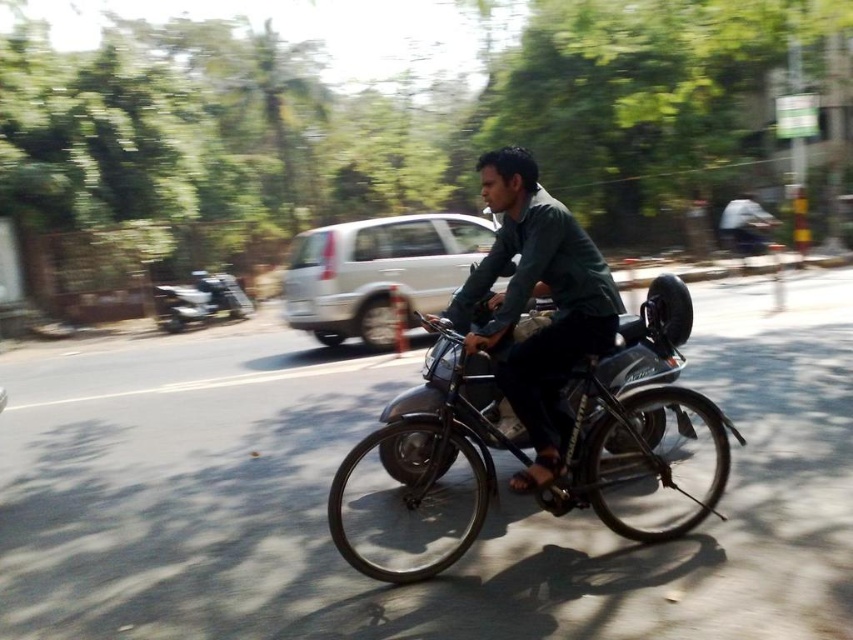
Between metallic silver motorcycle at center and green matte shirt at center, which one is positioned higher?

green matte shirt at center is higher up.

Identify the location of metallic silver motorcycle at center. This screenshot has width=853, height=640. (637, 419).

Locate an element on the screen. metallic silver motorcycle at center is located at coordinates (637, 419).

Which of these two, green matte shirt at center or metallic silver scooter at left, stands shorter?

Standing shorter between the two is metallic silver scooter at left.

Can you confirm if green matte shirt at center is wider than metallic silver scooter at left?

In fact, green matte shirt at center might be narrower than metallic silver scooter at left.

Where is `green matte shirt at center`? The image size is (853, 640). green matte shirt at center is located at coordinates (537, 296).

The height and width of the screenshot is (640, 853). I want to click on green matte shirt at center, so click(537, 296).

Who is higher up, metallic silver motorcycle at center or metallic silver scooter at left?

Positioned higher is metallic silver scooter at left.

Who is positioned more to the right, metallic silver motorcycle at center or metallic silver scooter at left?

metallic silver motorcycle at center is more to the right.

The width and height of the screenshot is (853, 640). I want to click on metallic silver motorcycle at center, so click(637, 419).